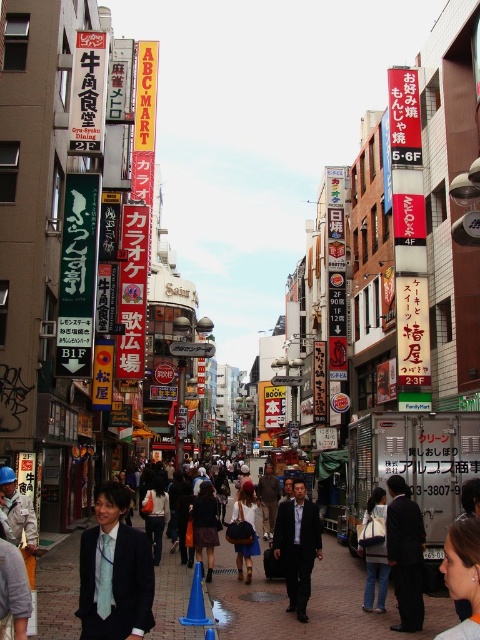
Is brick pavement at center behind denim jacket at center?

No.

Can you confirm if brick pavement at center is smaller than denim jacket at center?

No.

Image resolution: width=480 pixels, height=640 pixels. What do you see at coordinates (311, 604) in the screenshot?
I see `brick pavement at center` at bounding box center [311, 604].

At what (x,y) coordinates should I click in order to perform the action: click on brick pavement at center. Please return your answer as a coordinate pair (x, y). This screenshot has width=480, height=640. Looking at the image, I should click on point(311,604).

Does dark brown leather skirt at center appear on the right side of white plastic sign at center?

Yes, dark brown leather skirt at center is to the right of white plastic sign at center.

Can you confirm if dark brown leather skirt at center is wider than white plastic sign at center?

No.

Locate an element on the screen. Image resolution: width=480 pixels, height=640 pixels. dark brown leather skirt at center is located at coordinates (204, 524).

Is brick pavement at center wider than dark blue suit at center?

Correct, the width of brick pavement at center exceeds that of dark blue suit at center.

Does brick pavement at center appear under dark blue suit at center?

Actually, brick pavement at center is above dark blue suit at center.

I want to click on brick pavement at center, so click(311, 604).

Image resolution: width=480 pixels, height=640 pixels. I want to click on brick pavement at center, so click(311, 604).